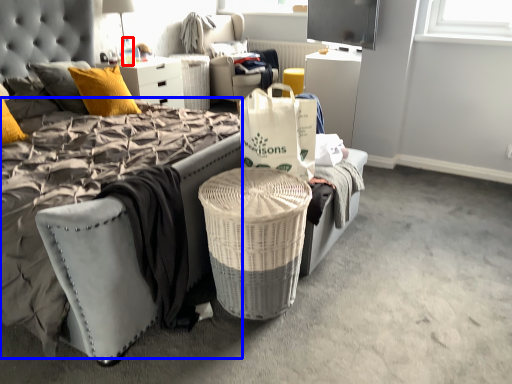
Question: Which object appears farthest to the camera in this image, bottle (highlighted by a red box) or mattress (highlighted by a blue box)?

Choices:
 (A) bottle
 (B) mattress

Answer: (A)